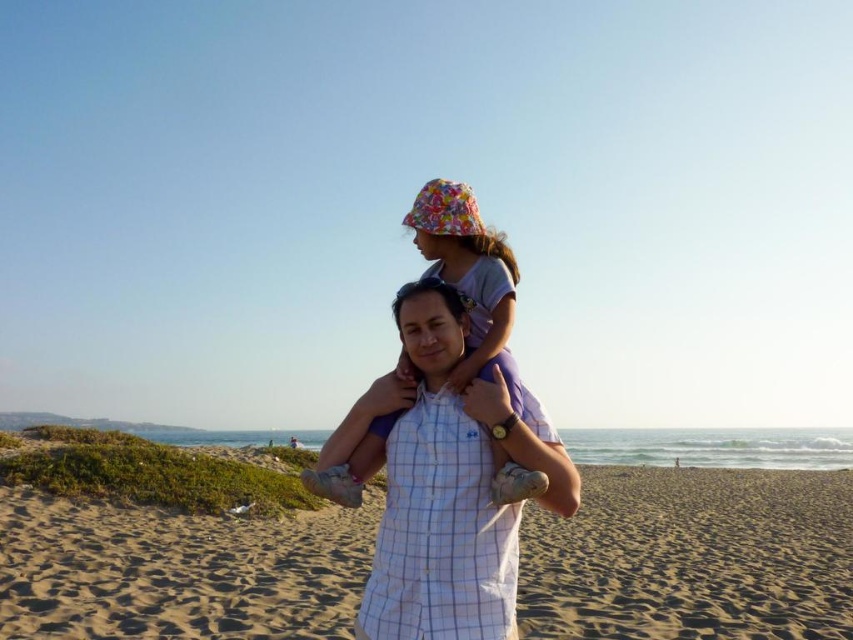
Which is below, white checkered shirt at center or floral fabric hat at center?

white checkered shirt at center is below.

Between white checkered shirt at center and floral fabric hat at center, which one appears on the left side from the viewer's perspective?

white checkered shirt at center is more to the left.

Who is more forward, (436, 385) or (495, 296)?

Point (436, 385) is in front.

This screenshot has height=640, width=853. Identify the location of white checkered shirt at center. (450, 486).

Who is higher up, sandy yellow sand at center or white checkered shirt at center?

white checkered shirt at center

Is point (111, 636) farther from camera compared to point (450, 410)?

Yes, point (111, 636) is behind point (450, 410).

The height and width of the screenshot is (640, 853). What do you see at coordinates (693, 556) in the screenshot? I see `sandy yellow sand at center` at bounding box center [693, 556].

Image resolution: width=853 pixels, height=640 pixels. In order to click on sandy yellow sand at center in this screenshot , I will do `click(693, 556)`.

Who is more forward, (x=154, y=604) or (x=405, y=225)?

Point (x=405, y=225)

Does sandy yellow sand at center have a lesser width compared to floral fabric hat at center?

Incorrect, sandy yellow sand at center's width is not less than floral fabric hat at center's.

The image size is (853, 640). What do you see at coordinates (693, 556) in the screenshot? I see `sandy yellow sand at center` at bounding box center [693, 556].

The height and width of the screenshot is (640, 853). I want to click on sandy yellow sand at center, so click(x=693, y=556).